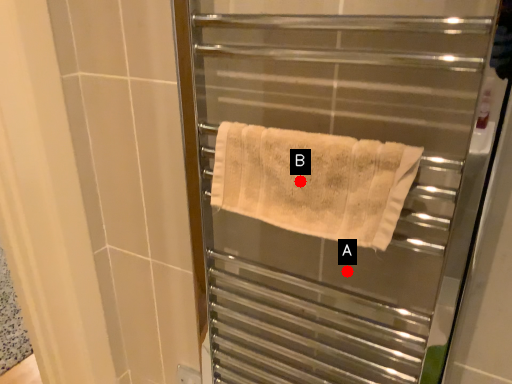
Question: Two points are circled on the image, labeled by A and B beside each circle. Which point is farther to the camera?

Choices:
 (A) A is further
 (B) B is further

Answer: (A)